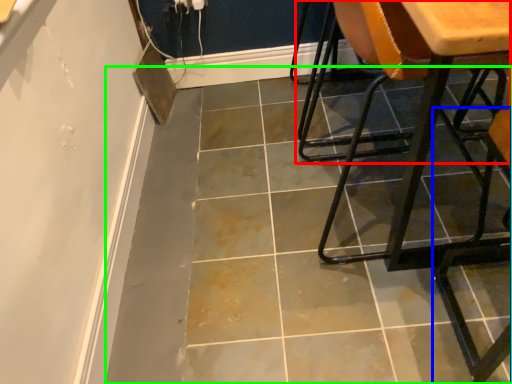
Question: Considering the real-world distances, which object is closest to chair (highlighted by a red box)? chair (highlighted by a blue box) or concrete (highlighted by a green box).

Choices:
 (A) chair
 (B) concrete

Answer: (B)